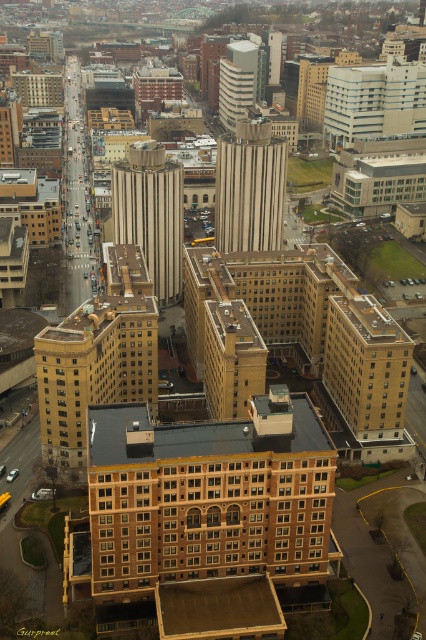
You are a drone operator tasked with capturing aerial footage of the city. Your drone has a maximum flight range of 250 meters. If you are positioned at the camera location, can your drone safely reach the beige stone tower at center without exceeding its range?

The distance between the beige stone tower at center and the camera is 227.96 meters, which is within the drone operator drone operator drone operator drone operator drone operator drone operator drone operator drone operator drone operator drone operator drone operator drone operator drone operator drone operator drone operator drone operator drone operator drone operator drone operator drone operator drone operator drone operator drone operator drone operator drone operator drone operator drone operator s

You are a city planner analyzing the aerial view of the city. You need to determine which tower, the striped concrete tower at center or the beige stone tower at center, has a greater height for potential antenna installation. Which one would you choose?

The beige stone tower at center is taller than the striped concrete tower at center, so you should choose the beige stone tower at center for antenna installation.